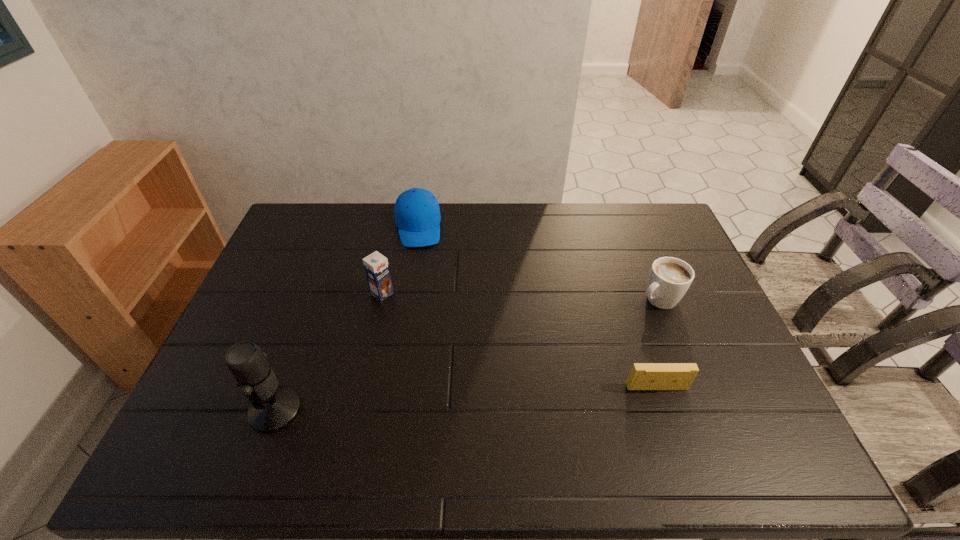
At what (x,y) coordinates should I click in order to perform the action: click on blank area in the image that satisfies the following two spatial constraints: 1. on the back side of the cap; 2. on the left side of the second tallest object. Please return your answer as a coordinate pair (x, y). Image resolution: width=960 pixels, height=540 pixels. Looking at the image, I should click on (397, 227).